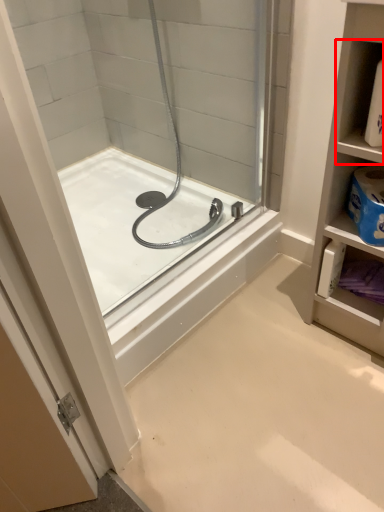
Question: In this image, where is shelf (annotated by the red box) located relative to bathtub?

Choices:
 (A) right
 (B) left

Answer: (A)